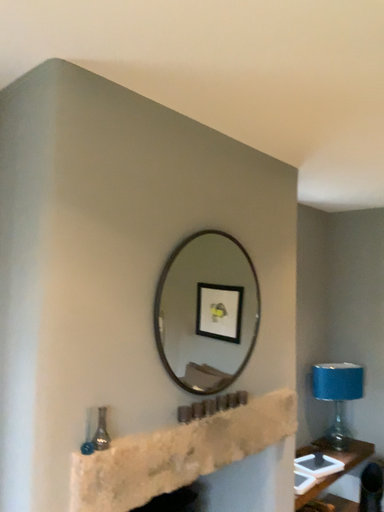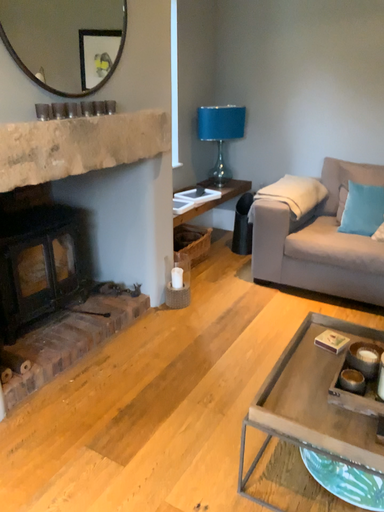
Question: How did the camera likely rotate when shooting the video?

Choices:
 (A) rotated left
 (B) rotated right

Answer: (B)